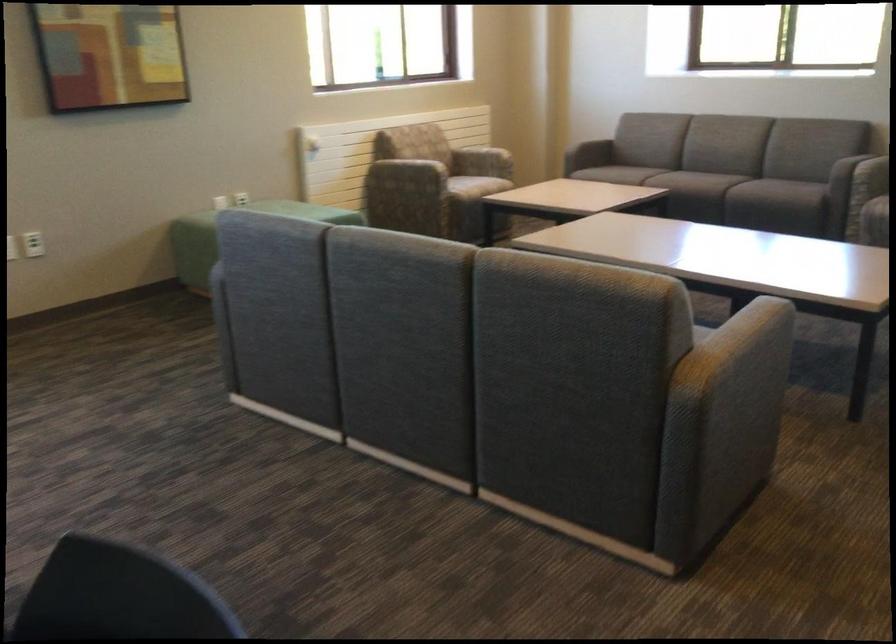
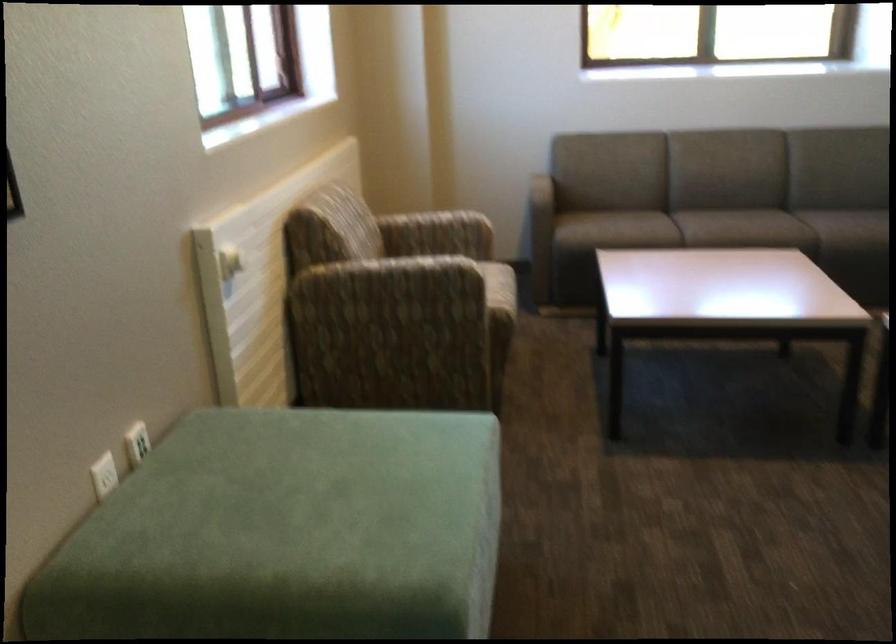
Where in the second image is the point corresponding to the point at 468,155 from the first image?

(436, 234)